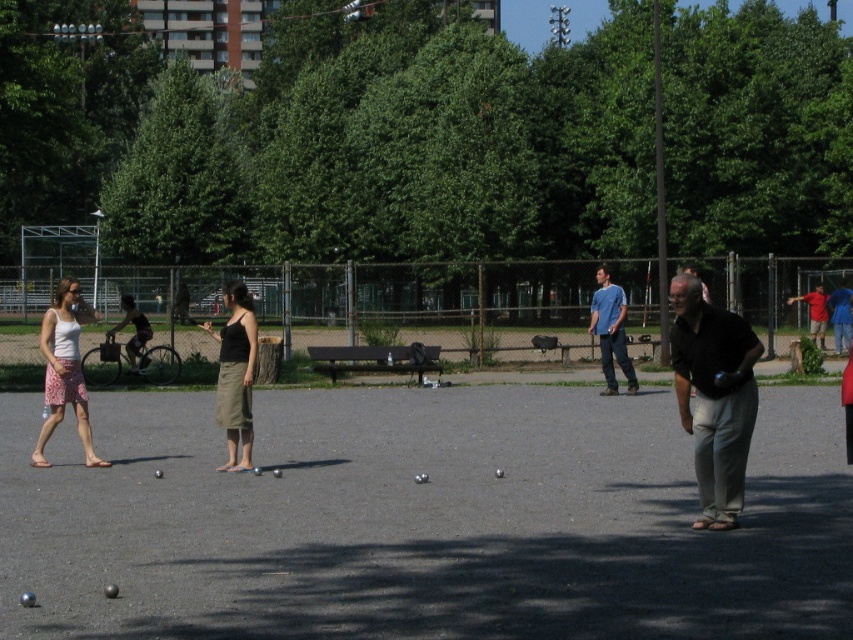
Does light pink floral skirt at left appear on the left side of matte blue shirt at center?

Yes, light pink floral skirt at left is to the left of matte blue shirt at center.

Can you confirm if light pink floral skirt at left is smaller than matte blue shirt at center?

Indeed, light pink floral skirt at left has a smaller size compared to matte blue shirt at center.

Describe the element at coordinates (65, 369) in the screenshot. I see `light pink floral skirt at left` at that location.

The image size is (853, 640). I want to click on light pink floral skirt at left, so click(x=65, y=369).

Between matte blue shirt at center and dark gray fabric shirt at left, which one is positioned lower?

matte blue shirt at center is below.

Is point (610, 323) farther from camera compared to point (125, 321)?

No, it is not.

Is point (612, 376) less distant than point (131, 308)?

Yes, it is in front of point (131, 308).

At what (x,y) coordinates should I click in order to perform the action: click on matte blue shirt at center. Please return your answer as a coordinate pair (x, y). Image resolution: width=853 pixels, height=640 pixels. Looking at the image, I should click on (610, 330).

The image size is (853, 640). Describe the element at coordinates (714, 397) in the screenshot. I see `dark brown shirt at center` at that location.

Is dark brown shirt at center taller than light pink floral skirt at left?

Correct, dark brown shirt at center is much taller as light pink floral skirt at left.

Measure the distance between point (x=733, y=316) and camera.

A distance of 33.73 feet exists between point (x=733, y=316) and camera.

Find the location of `dark brown shirt at center`. dark brown shirt at center is located at coordinates (714, 397).